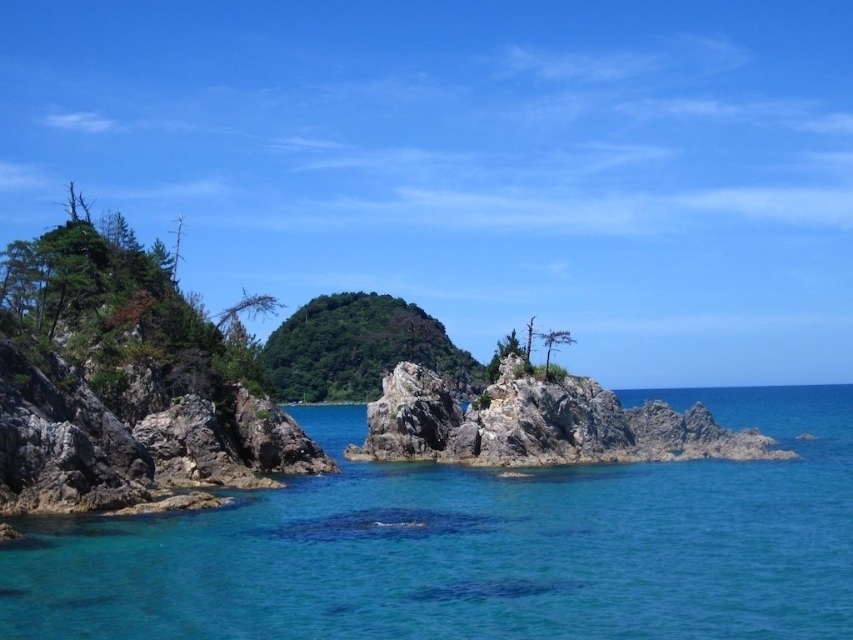
You are standing on a boat in the middle of the sea and see the clear blue water at center and the rocky at center. Which one is closer to you?

The clear blue water at center is closer to you because it is in front of the rocky at center.

You are planning to sail a small boat through the coastal area shown. The boat requires a passage that is wider than the green matte tree at center. Can the clear blue water at center provide a suitable path?

The clear blue water at center is wider than the green matte tree at center, so yes, the boat can use the clear blue water at center as it meets the required width.

Looking at this image, you are a bird looking for a nesting spot. You see two trees at the center of the image, a green leafy tree at center and a green matte tree at center. Which tree has a wider canopy for nesting?

The green leafy tree at center has a larger width than the green matte tree at center, making its canopy wider for nesting.